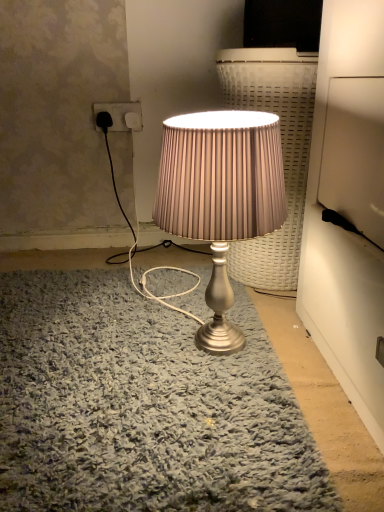
Question: From a real-world perspective, does satin silver lamp at center stand above matte white socket at upper left?

Choices:
 (A) no
 (B) yes

Answer: (A)

Question: From the image's perspective, is satin silver lamp at center on matte white socket at upper left?

Choices:
 (A) no
 (B) yes

Answer: (A)

Question: Considering the relative sizes of satin silver lamp at center and matte white socket at upper left in the image provided, is satin silver lamp at center taller than matte white socket at upper left?

Choices:
 (A) yes
 (B) no

Answer: (A)

Question: Is satin silver lamp at center positioned before matte white socket at upper left?

Choices:
 (A) no
 (B) yes

Answer: (B)

Question: Considering the relative sizes of satin silver lamp at center and matte white socket at upper left in the image provided, is satin silver lamp at center thinner than matte white socket at upper left?

Choices:
 (A) no
 (B) yes

Answer: (A)

Question: Is satin silver lamp at center at the left side of matte white socket at upper left?

Choices:
 (A) yes
 (B) no

Answer: (B)

Question: Is there a large distance between matte white socket at upper left and satin silver lamp at center?

Choices:
 (A) yes
 (B) no

Answer: (B)

Question: Is matte white socket at upper left positioned before satin silver lamp at center?

Choices:
 (A) yes
 (B) no

Answer: (B)

Question: Considering the relative sizes of matte white socket at upper left and satin silver lamp at center in the image provided, is matte white socket at upper left thinner than satin silver lamp at center?

Choices:
 (A) no
 (B) yes

Answer: (B)

Question: From a real-world perspective, is matte white socket at upper left below satin silver lamp at center?

Choices:
 (A) yes
 (B) no

Answer: (B)

Question: Is satin silver lamp at center inside matte white socket at upper left?

Choices:
 (A) no
 (B) yes

Answer: (A)

Question: Considering the relative sizes of matte white socket at upper left and satin silver lamp at center in the image provided, is matte white socket at upper left bigger than satin silver lamp at center?

Choices:
 (A) yes
 (B) no

Answer: (B)

Question: In the image, is satin silver lamp at center positioned in front of or behind matte white socket at upper left?

Choices:
 (A) front
 (B) behind

Answer: (A)